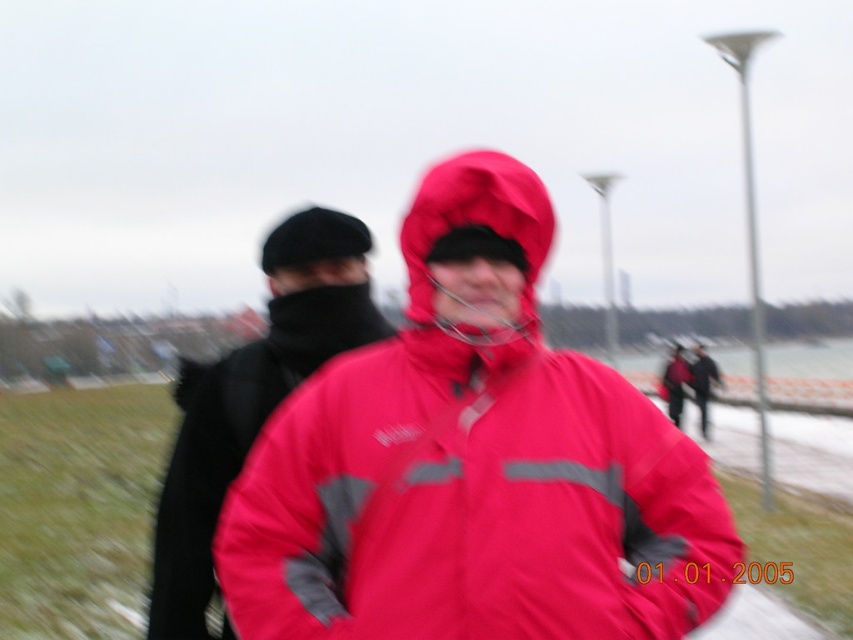
You are a photographer trying to capture both the matte pink jacket at center and the black matte jacket at left in the same frame. Based on their positions and sizes in the image, which jacket appears larger?

The matte pink jacket at center appears larger than the black matte jacket at left because it is wider.

You are a photographer trying to capture a group photo of the matte pink jacket at center and the black matte jacket at left. The camera you are using has a maximum focus range of 30 inches. Can both jackets be in focus simultaneously?

The distance between the matte pink jacket at center and the black matte jacket at left is 32.22 inches, which exceeds the camera maximum focus range of 30 inches. Therefore, both jackets cannot be in focus simultaneously.